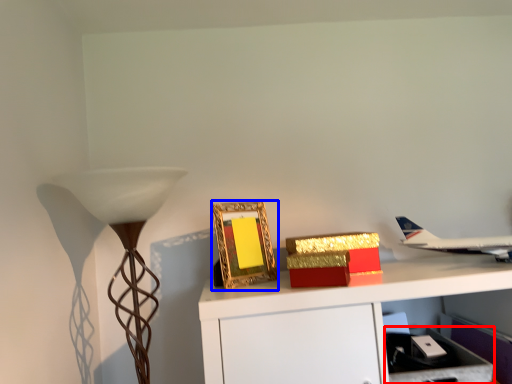
Question: Which point is further to the camera, drawer (highlighted by a red box) or picture frame (highlighted by a blue box)?

Choices:
 (A) drawer
 (B) picture frame

Answer: (B)